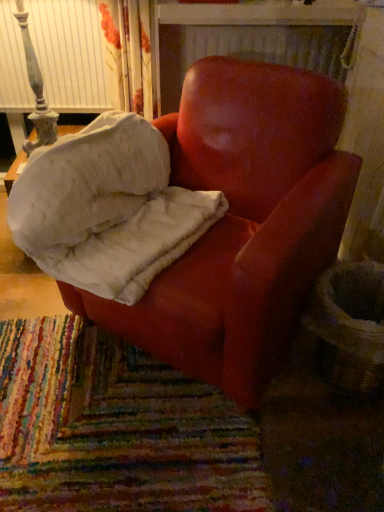
This screenshot has height=512, width=384. What do you see at coordinates (243, 223) in the screenshot?
I see `matte red armchair at center` at bounding box center [243, 223].

This screenshot has height=512, width=384. What are the coordinates of `matte red armchair at center` in the screenshot? It's located at (243, 223).

Measure the distance between point (x=170, y=270) and camera.

The depth of point (x=170, y=270) is 1.16 meters.

This screenshot has height=512, width=384. What do you see at coordinates (107, 208) in the screenshot? I see `velvet red armchair at center` at bounding box center [107, 208].

You are a GUI agent. You are given a task and a screenshot of the screen. Output one action in this format:
    pyautogui.click(x=<x>, y=<y>)
    Task: Click on the velvet red armchair at center
    The image size is (384, 512).
    Given the screenshot: What is the action you would take?
    pyautogui.click(x=107, y=208)

You are a GUI agent. You are given a task and a screenshot of the screen. Output one action in this format:
    pyautogui.click(x=<x>, y=<y>)
    Task: Click on the matte red armchair at center
    This screenshot has width=384, height=512.
    Given the screenshot: What is the action you would take?
    pyautogui.click(x=243, y=223)

Between matte red armchair at center and velvet red armchair at center, which one appears on the right side from the viewer's perspective?

matte red armchair at center.

Is the position of matte red armchair at center more distant than that of velvet red armchair at center?

No.

Does point (186, 362) appear closer or farther from the camera than point (166, 259)?

Point (186, 362) is farther from the camera than point (166, 259).

From the image's perspective, would you say matte red armchair at center is positioned over velvet red armchair at center?

No, from the image's perspective, matte red armchair at center is not above velvet red armchair at center.

From a real-world perspective, is matte red armchair at center positioned above or below velvet red armchair at center?

matte red armchair at center is below velvet red armchair at center.

Does matte red armchair at center have a greater width compared to velvet red armchair at center?

Indeed, matte red armchair at center has a greater width compared to velvet red armchair at center.

From their relative heights in the image, would you say matte red armchair at center is taller or shorter than velvet red armchair at center?

matte red armchair at center is taller than velvet red armchair at center.

Who is smaller, matte red armchair at center or velvet red armchair at center?

velvet red armchair at center is smaller.

Is matte red armchair at center positioned beyond the bounds of velvet red armchair at center?

matte red armchair at center lies outside velvet red armchair at center's area.

Are matte red armchair at center and velvet red armchair at center making contact?

No, matte red armchair at center is not beside velvet red armchair at center.

Is matte red armchair at center looking in the opposite direction of velvet red armchair at center?

That's right, matte red armchair at center is facing away from velvet red armchair at center.

What's the angular difference between matte red armchair at center and velvet red armchair at center's facing directions?

2.74 degrees.

You are a GUI agent. You are given a task and a screenshot of the screen. Output one action in this format:
    pyautogui.click(x=<x>, y=<y>)
    Task: Click on the material on the left of matte red armchair at center
    This screenshot has width=384, height=512.
    Given the screenshot: What is the action you would take?
    pyautogui.click(x=107, y=208)

In the scene shown: Between velvet red armchair at center and matte red armchair at center, which one appears on the right side from the viewer's perspective?

matte red armchair at center is more to the right.

Which object is further away from the camera taking this photo, velvet red armchair at center or matte red armchair at center?

Positioned behind is velvet red armchair at center.

Is point (74, 256) closer to camera compared to point (180, 166)?

That is True.

From the image's perspective, is velvet red armchair at center located above or below matte red armchair at center?

Based on their image positions, velvet red armchair at center is located above matte red armchair at center.

From a real-world perspective, who is located lower, velvet red armchair at center or matte red armchair at center?

matte red armchair at center.

Does velvet red armchair at center have a lesser width compared to matte red armchair at center?

Yes, velvet red armchair at center is thinner than matte red armchair at center.

Can you confirm if velvet red armchair at center is shorter than matte red armchair at center?

Yes.

Looking at the image, does velvet red armchair at center seem bigger or smaller compared to matte red armchair at center?

Considering their sizes, velvet red armchair at center takes up less space than matte red armchair at center.

Is velvet red armchair at center completely or partially outside of matte red armchair at center?

No.

Are velvet red armchair at center and matte red armchair at center making contact?

No, velvet red armchair at center is not touching matte red armchair at center.

Is velvet red armchair at center oriented towards matte red armchair at center?

Yes, velvet red armchair at center is turned towards matte red armchair at center.

At what (x,y) coordinates should I click in order to perform the action: click on material on the left of matte red armchair at center. Please return your answer as a coordinate pair (x, y). The image size is (384, 512). Looking at the image, I should click on (107, 208).

Image resolution: width=384 pixels, height=512 pixels. Identify the location of material on the left of matte red armchair at center. (107, 208).

Locate an element on the screen. chair in front of the velvet red armchair at center is located at coordinates (243, 223).